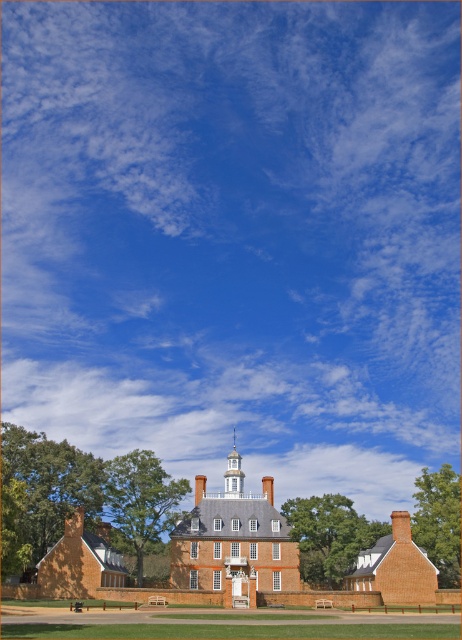
Question: Which point appears farthest from the camera in this image?

Choices:
 (A) (267, 483)
 (B) (205, 486)

Answer: (A)

Question: Is red brick chimney at center to the left of brick chimney at center from the viewer's perspective?

Choices:
 (A) no
 (B) yes

Answer: (B)

Question: Is red brick chimney at center positioned at the back of brick chimney at center?

Choices:
 (A) yes
 (B) no

Answer: (B)

Question: Which point is farther to the camera?

Choices:
 (A) (268, 476)
 (B) (195, 500)

Answer: (A)

Question: Can you confirm if red brick chimney at center is thinner than brick chimney at center?

Choices:
 (A) yes
 (B) no

Answer: (B)